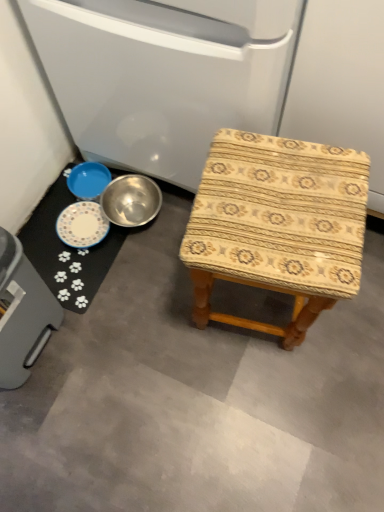
The height and width of the screenshot is (512, 384). What are the coordinates of `vacant space in between wooden-patterned stool at center and gray plastic trash can at lower left, which ranks as the first appliance in bottom-to-top order` in the screenshot? It's located at (145, 332).